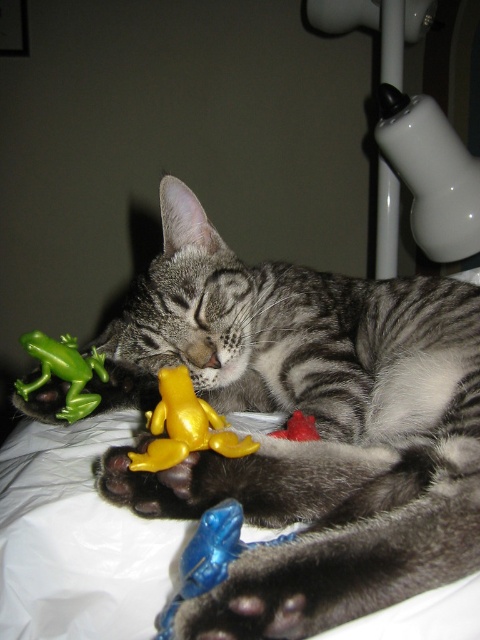
Measure the distance from gray striped fur cat at center to yellow rubber frog at center.

They are 28.29 centimeters apart.

Who is positioned more to the left, gray striped fur cat at center or yellow rubber frog at center?

yellow rubber frog at center

Which is in front, point (432, 365) or point (205, 448)?

Point (205, 448) is in front.

Where is `gray striped fur cat at center`? gray striped fur cat at center is located at coordinates (315, 420).

Which of these two, yellow rubber frog at center or blue rubber toy at lower center, stands shorter?

yellow rubber frog at center is shorter.

Is yellow rubber frog at center shorter than blue rubber toy at lower center?

Yes, yellow rubber frog at center is shorter than blue rubber toy at lower center.

Is point (184, 392) positioned before point (276, 541)?

No, (184, 392) is behind (276, 541).

Locate an element on the screen. The image size is (480, 640). yellow rubber frog at center is located at coordinates (184, 426).

Is gray striped fur cat at center to the right of green matte frog at left from the viewer's perspective?

Correct, you'll find gray striped fur cat at center to the right of green matte frog at left.

Can you confirm if gray striped fur cat at center is bigger than green matte frog at left?

Indeed, gray striped fur cat at center has a larger size compared to green matte frog at left.

Does point (179, 358) lie in front of point (59, 353)?

No, (179, 358) is behind (59, 353).

Where is `gray striped fur cat at center`? Image resolution: width=480 pixels, height=640 pixels. gray striped fur cat at center is located at coordinates (315, 420).